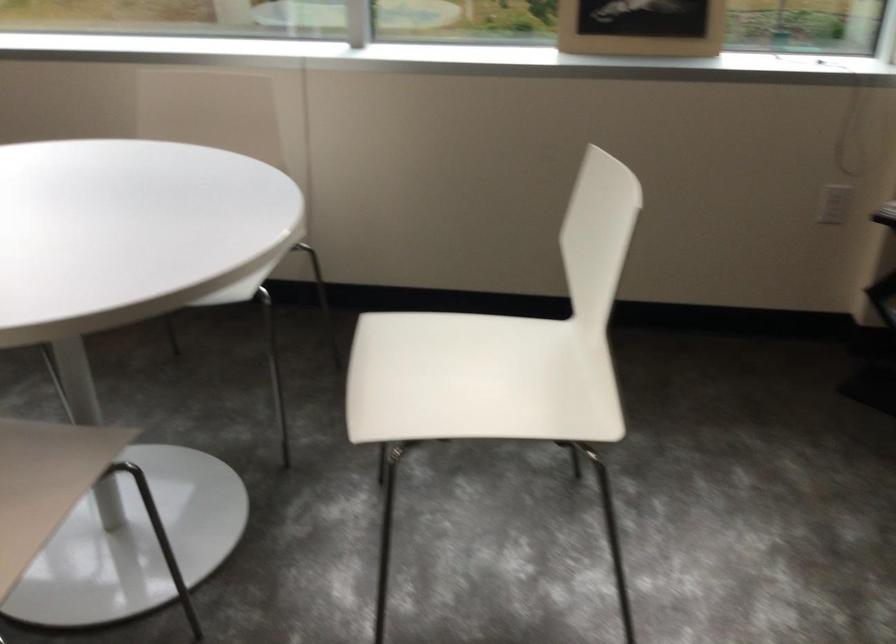
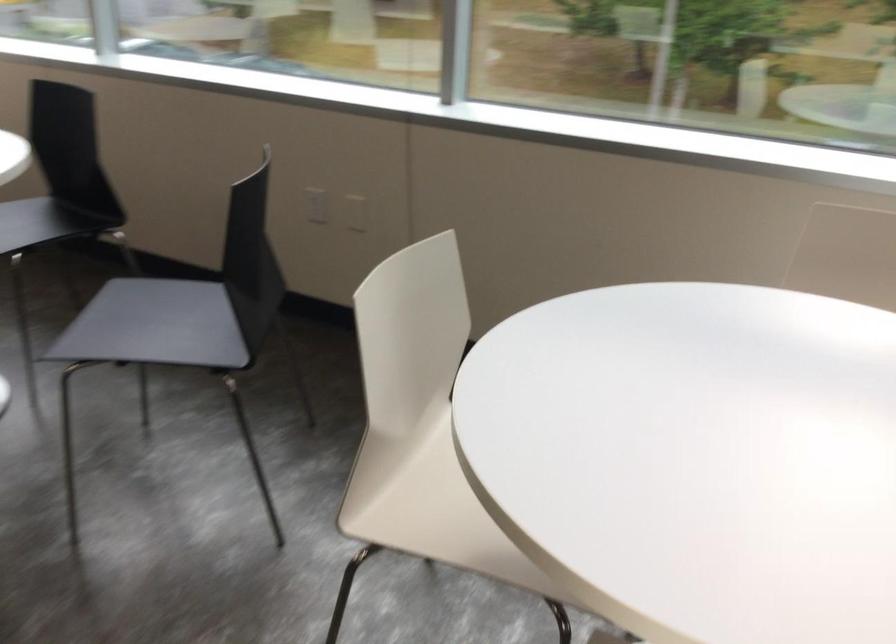
Question: The camera is either moving clockwise (left) or counter-clockwise (right) around the object. The first image is from the beginning of the video and the second image is from the end. Is the camera moving left or right when shooting the video?

Choices:
 (A) Left
 (B) Right

Answer: (B)